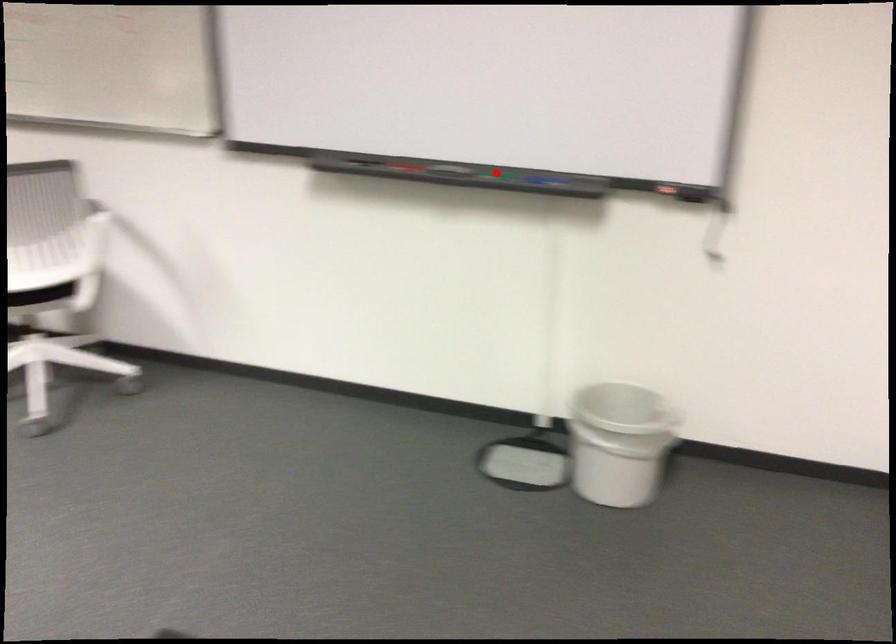
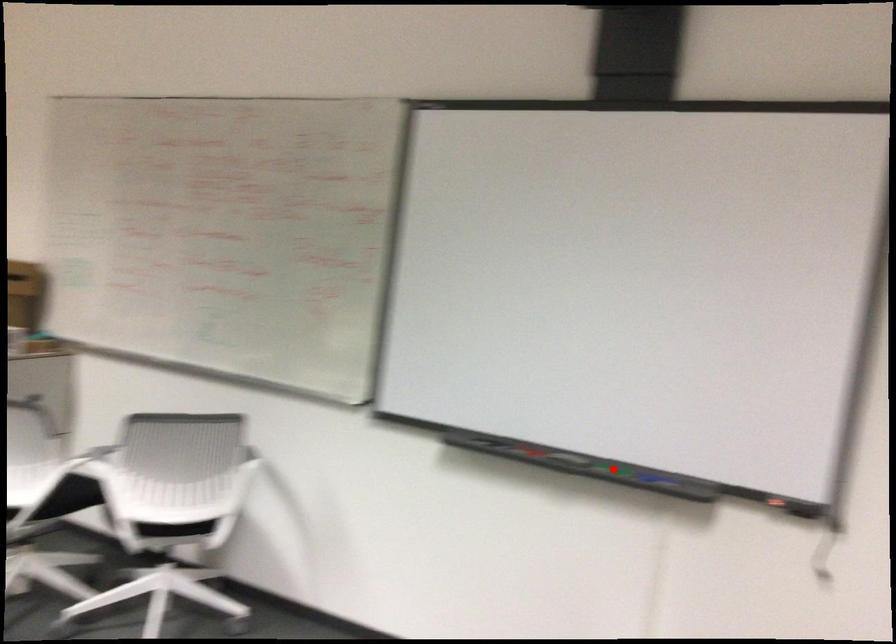
Based on the photo, I am providing you with two images of the same scene from different viewpoints. A red point is marked on the first image and another point is marked on the second image. Is the marked point in image1 the same physical position as the marked point in image2?

Yes